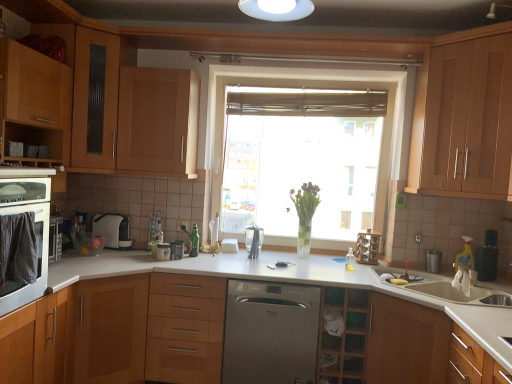
This screenshot has width=512, height=384. I want to click on free space to the back side of metallic silver toaster at center, the 2th appliance in the left-to-right sequence, so click(x=184, y=255).